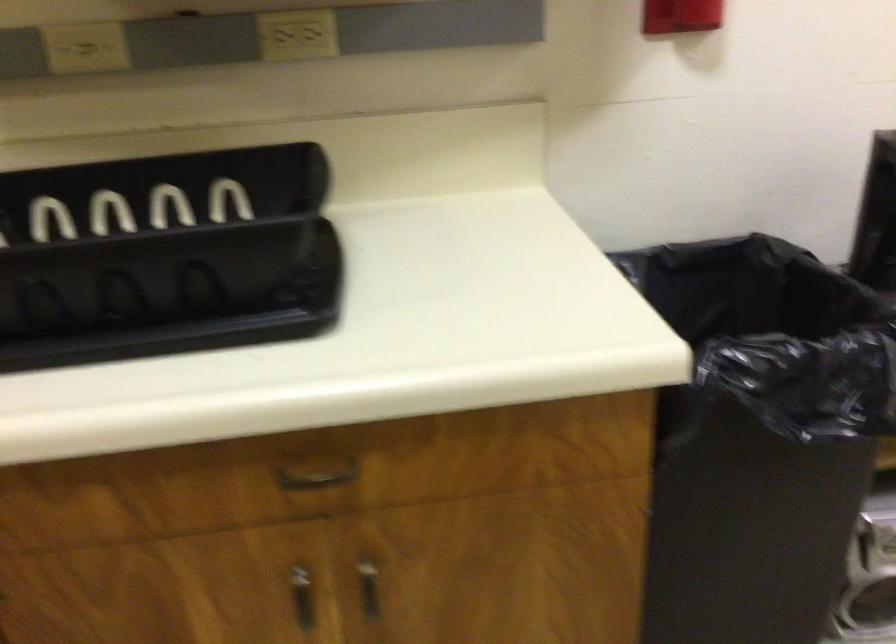
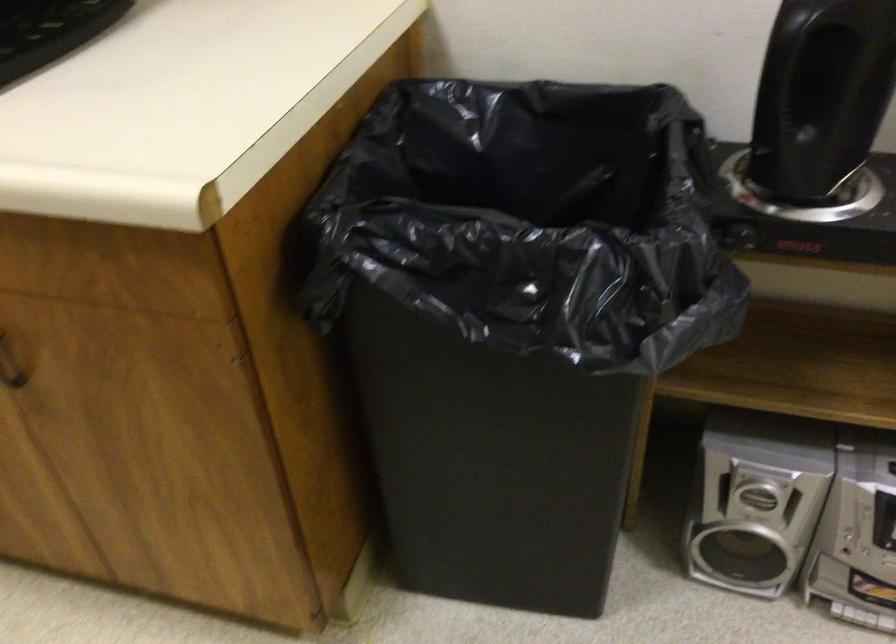
How did the camera likely rotate?

The camera rotated toward left-down.